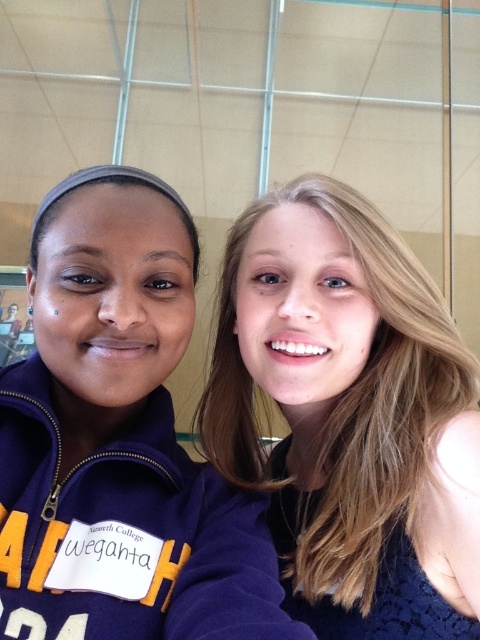
Question: Does blonde hair at upper right have a greater width compared to matte purple sweatshirt at center?

Choices:
 (A) yes
 (B) no

Answer: (A)

Question: Can you confirm if blonde hair at upper right is bigger than matte purple sweatshirt at center?

Choices:
 (A) no
 (B) yes

Answer: (B)

Question: Which of the following is the closest to the observer?

Choices:
 (A) matte purple sweatshirt at center
 (B) blonde hair at upper right

Answer: (A)

Question: Is blonde hair at upper right to the left of matte purple sweatshirt at center from the viewer's perspective?

Choices:
 (A) yes
 (B) no

Answer: (B)

Question: Which object appears farthest from the camera in this image?

Choices:
 (A) matte purple sweatshirt at center
 (B) blonde hair at upper right

Answer: (B)

Question: Which of the following is the closest to the observer?

Choices:
 (A) (348, 204)
 (B) (36, 544)

Answer: (B)